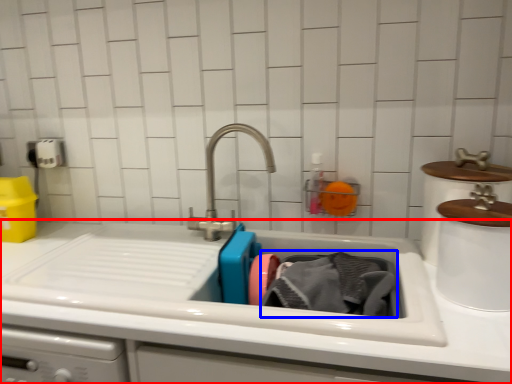
Question: Which object appears closest to the camera in this image, counter top (highlighted by a red box) or clothing (highlighted by a blue box)?

Choices:
 (A) counter top
 (B) clothing

Answer: (A)